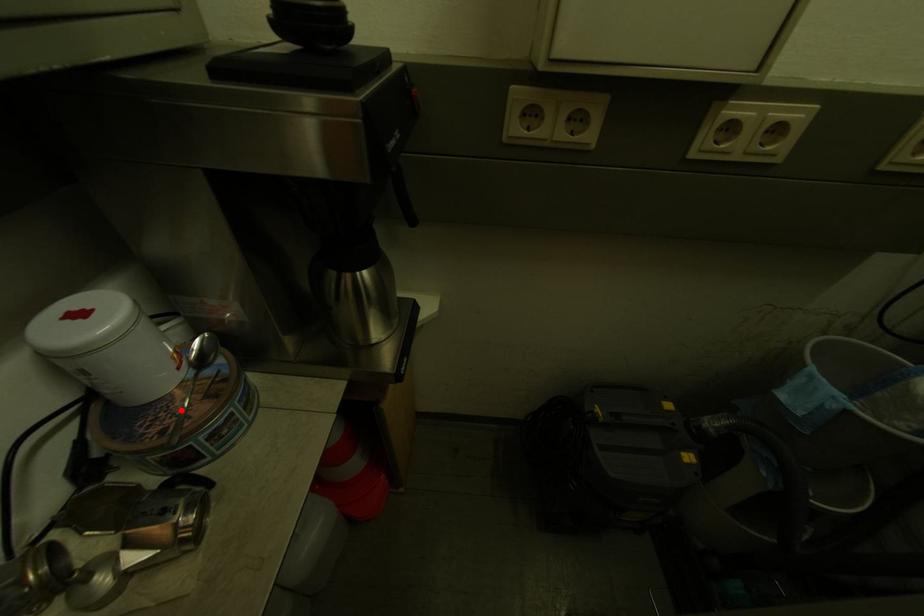
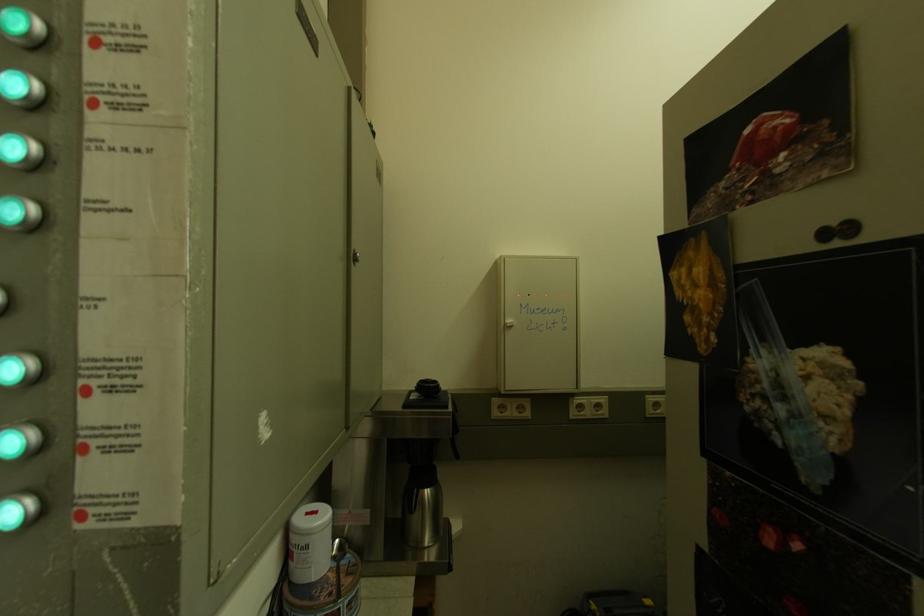
The point at the highlighted location is marked in the first image. Where is the corresponding point in the second image?

(339, 586)